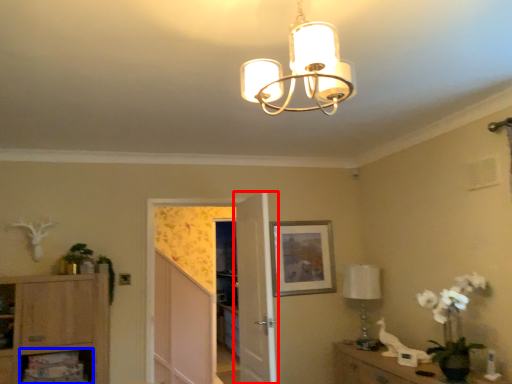
Question: Which object is further to the camera taking this photo, door (highlighted by a red box) or shelf (highlighted by a blue box)?

Choices:
 (A) door
 (B) shelf

Answer: (B)